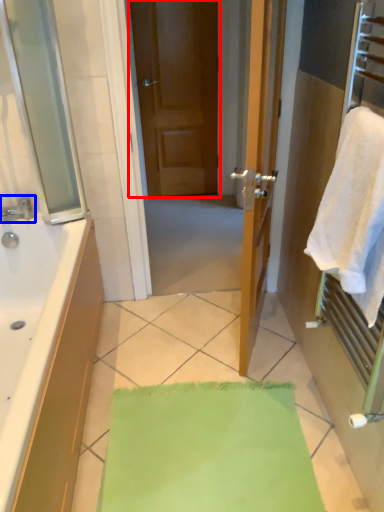
Question: Which object appears closest to the camera in this image, door (highlighted by a red box) or tap (highlighted by a blue box)?

Choices:
 (A) door
 (B) tap

Answer: (B)